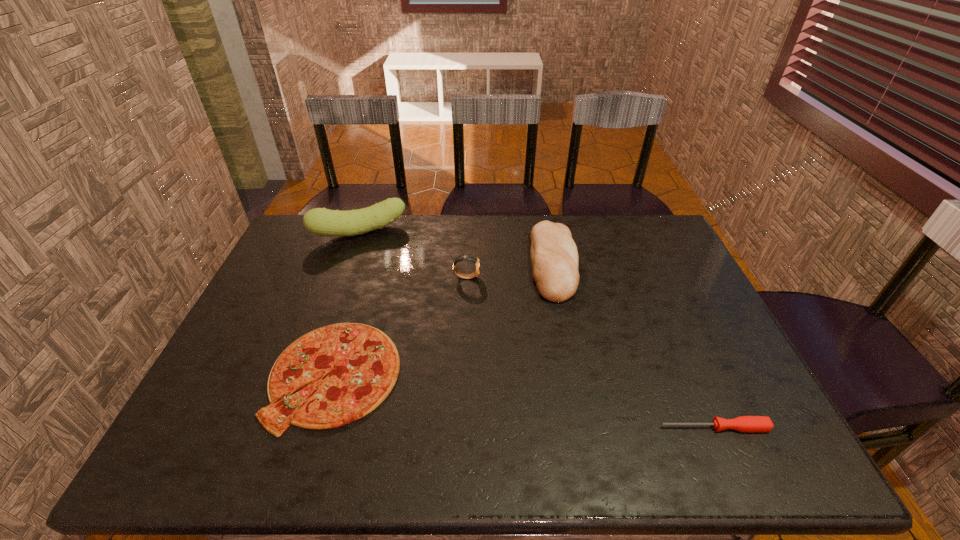
Locate an element on the screen. empty space that is in between the pizza and the screwdriver is located at coordinates click(524, 401).

Find the location of `free space that is in between the rightmost object and the tallest object`. free space that is in between the rightmost object and the tallest object is located at coordinates (537, 330).

What are the coordinates of `vacant area between the watch and the pizza` in the screenshot? It's located at (400, 326).

Identify the location of vacant point located between the third object from left to right and the tallest object. (413, 255).

Identify the location of free space between the second object from right to left and the cucumber. Image resolution: width=960 pixels, height=540 pixels. (456, 248).

Locate an element on the screen. The image size is (960, 540). free point between the pizza and the rightmost object is located at coordinates (524, 401).

Identify the location of the third closest object to the screwdriver. (472, 258).

The image size is (960, 540). I want to click on object that is the third closest to the cucumber, so click(x=554, y=257).